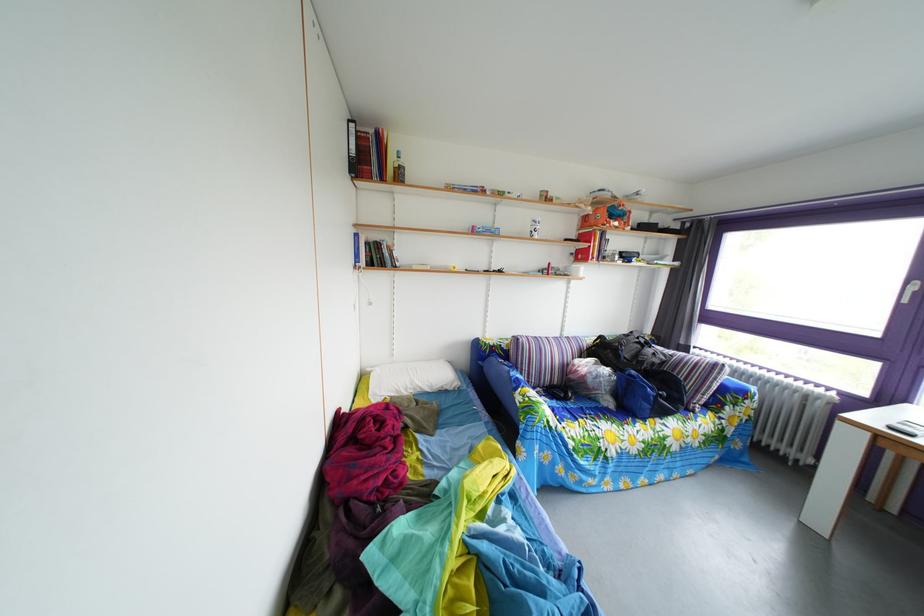
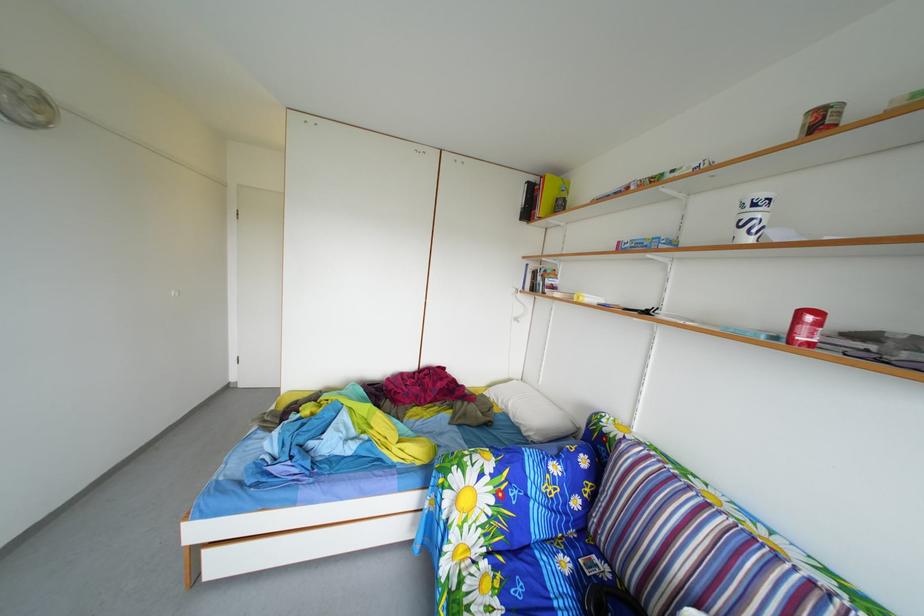
Find the pixel in the second image that matches point (561, 273) in the first image.

(811, 321)